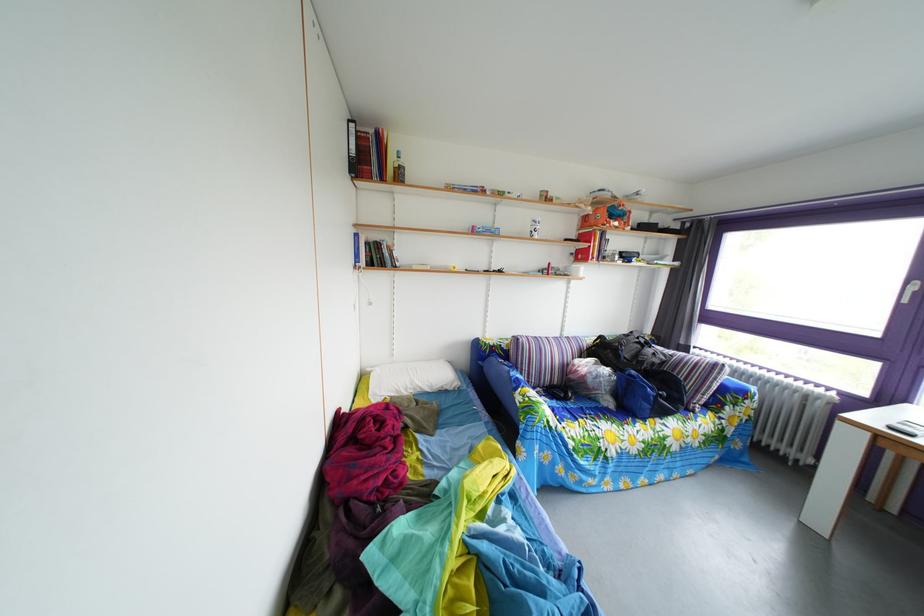
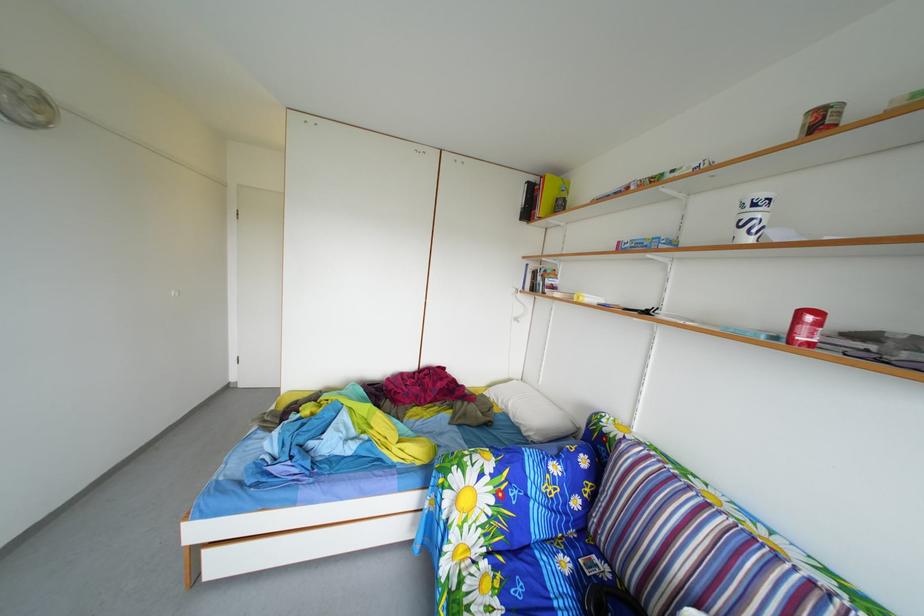
Find the pixel in the second image that matches point (561, 273) in the first image.

(811, 321)